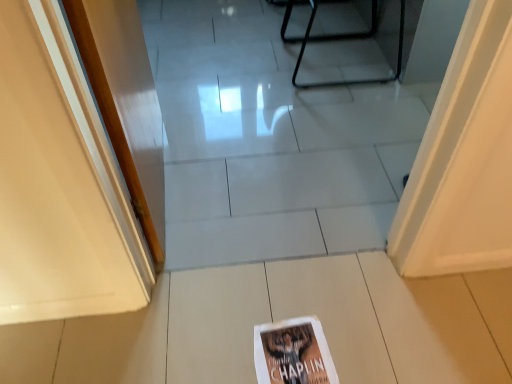
Question: Should I look upward or downward to see white paper book at center?

Choices:
 (A) down
 (B) up

Answer: (A)